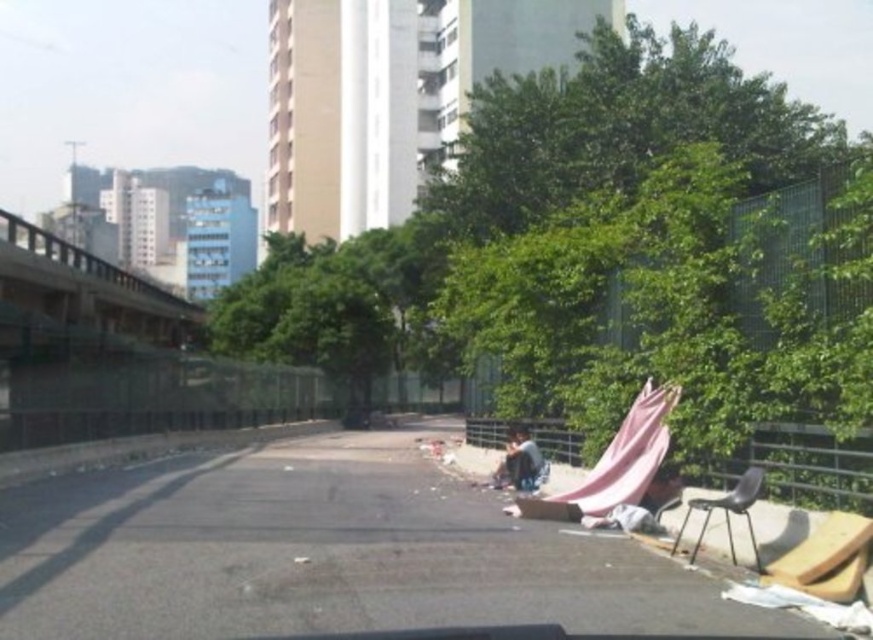
Is brushed metal overpass at upper left smaller than black plastic chair at lower right?

Incorrect, brushed metal overpass at upper left is not smaller in size than black plastic chair at lower right.

Which is below, brushed metal overpass at upper left or black plastic chair at lower right?

black plastic chair at lower right is below.

Where is `brushed metal overpass at upper left`? Image resolution: width=873 pixels, height=640 pixels. brushed metal overpass at upper left is located at coordinates (88, 288).

Locate an element on the screen. The height and width of the screenshot is (640, 873). brushed metal overpass at upper left is located at coordinates (88, 288).